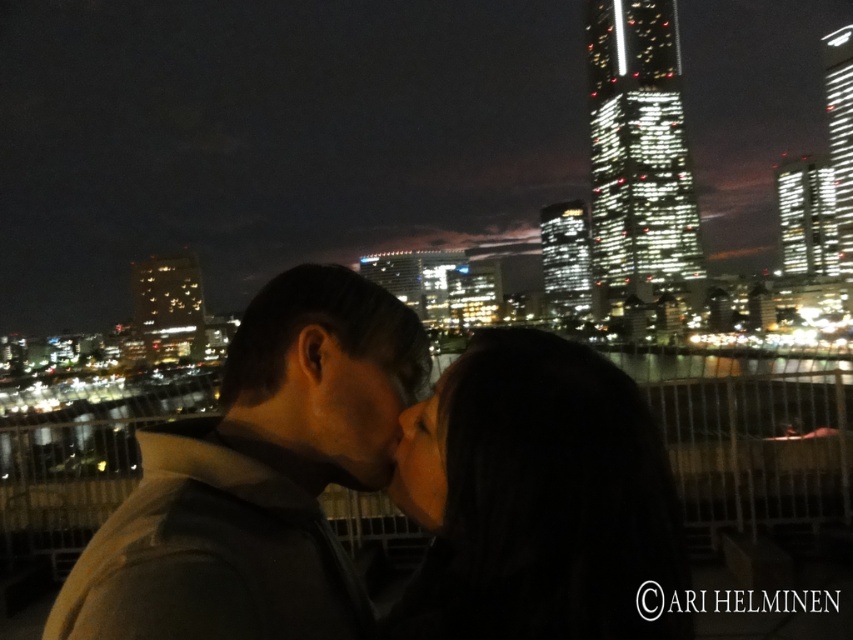
Question: Considering the relative positions of dark brown leather jacket at center and dark hair at center in the image provided, where is dark brown leather jacket at center located with respect to dark hair at center?

Choices:
 (A) below
 (B) above

Answer: (B)

Question: Can you confirm if dark brown leather jacket at center is bigger than dark hair at center?

Choices:
 (A) no
 (B) yes

Answer: (B)

Question: Which object is farther from the camera taking this photo?

Choices:
 (A) dark brown leather jacket at center
 (B) dark hair at center

Answer: (B)

Question: Is dark brown leather jacket at center further to the viewer compared to dark hair at center?

Choices:
 (A) yes
 (B) no

Answer: (B)